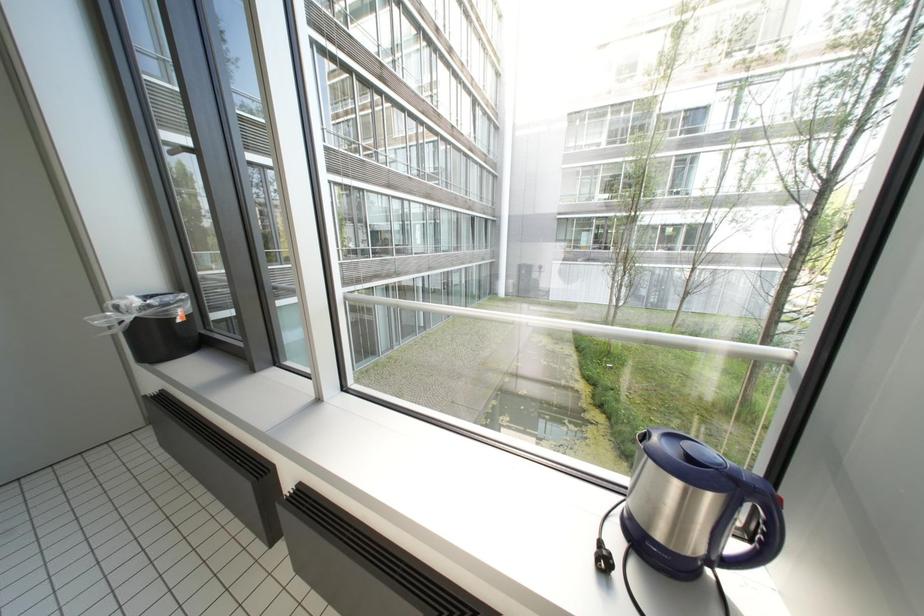
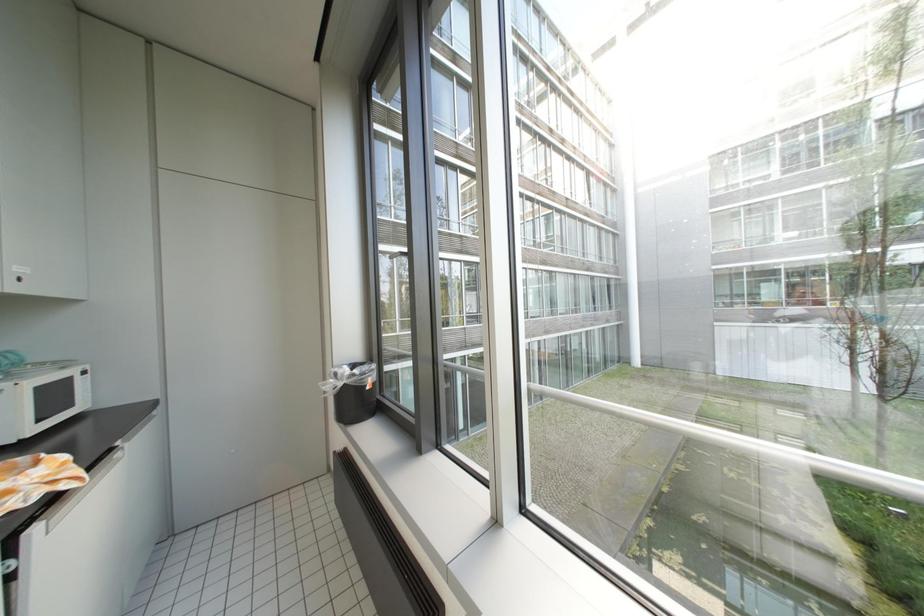
Question: Based on the continuous images, in which direction is the camera rotating? Reply with the corresponding letter.

Choices:
 (A) Left
 (B) Right
 (C) Up
 (D) Down

Answer: (A)